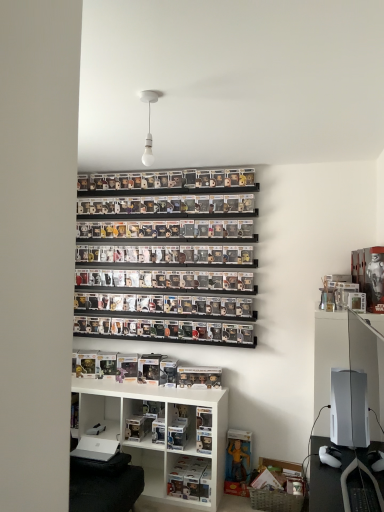
Question: Considering the relative sizes of white plastic shelf at lower center, which is the second shelf from top to bottom, and white matte gaming console at right in the image provided, is white plastic shelf at lower center, which is the second shelf from top to bottom, smaller than white matte gaming console at right?

Choices:
 (A) yes
 (B) no

Answer: (A)

Question: Considering the relative sizes of white plastic shelf at lower center, acting as the 2th shelf starting from the bottom, and white matte gaming console at right in the image provided, is white plastic shelf at lower center, acting as the 2th shelf starting from the bottom, bigger than white matte gaming console at right?

Choices:
 (A) yes
 (B) no

Answer: (B)

Question: Is white plastic shelf at lower center, which is the second shelf from top to bottom, positioned with its back to white matte gaming console at right?

Choices:
 (A) no
 (B) yes

Answer: (A)

Question: Is white plastic shelf at lower center, acting as the 2th shelf starting from the bottom, to the left of white matte gaming console at right from the viewer's perspective?

Choices:
 (A) yes
 (B) no

Answer: (A)

Question: Is white matte gaming console at right completely or partially inside white plastic shelf at lower center, which is the second shelf from top to bottom?

Choices:
 (A) yes
 (B) no

Answer: (B)

Question: From a real-world perspective, does white plastic shelf at lower center, which is the second shelf from top to bottom, stand above white matte gaming console at right?

Choices:
 (A) yes
 (B) no

Answer: (B)

Question: Is the depth of white plastic shelf at lower center, which is the second shelf from top to bottom, greater than that of clear plastic figures at center, which is the 1th shelf from top to bottom?

Choices:
 (A) no
 (B) yes

Answer: (A)

Question: From the image's perspective, would you say white plastic shelf at lower center, which is the second shelf from top to bottom, is shown under clear plastic figures at center, which is the 1th shelf from top to bottom?

Choices:
 (A) no
 (B) yes

Answer: (B)

Question: Does white plastic shelf at lower center, acting as the 2th shelf starting from the bottom, have a lesser width compared to clear plastic figures at center, placed as the 3th shelf when sorted from bottom to top?

Choices:
 (A) yes
 (B) no

Answer: (B)

Question: Can we say white plastic shelf at lower center, which is the second shelf from top to bottom, lies outside clear plastic figures at center, which is the 1th shelf from top to bottom?

Choices:
 (A) no
 (B) yes

Answer: (B)

Question: Can you confirm if white plastic shelf at lower center, which is the second shelf from top to bottom, is wider than clear plastic figures at center, placed as the 3th shelf when sorted from bottom to top?

Choices:
 (A) no
 (B) yes

Answer: (B)

Question: Could you tell me if white plastic shelf at lower center, which is the second shelf from top to bottom, is facing clear plastic figures at center, which is the 1th shelf from top to bottom?

Choices:
 (A) yes
 (B) no

Answer: (B)

Question: Is white matte bulb at upper center oriented away from clear plastic figures at center, placed as the 3th shelf when sorted from bottom to top?

Choices:
 (A) no
 (B) yes

Answer: (A)